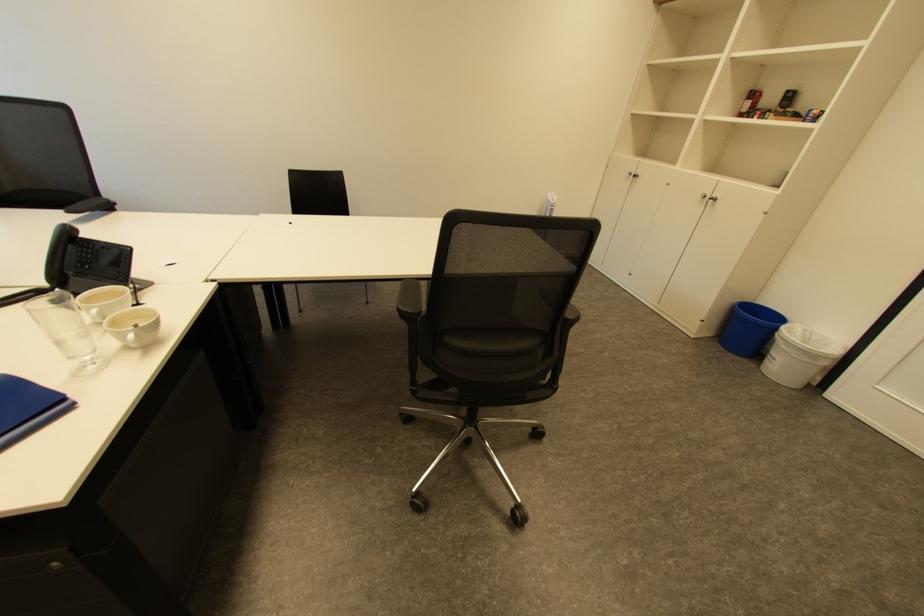
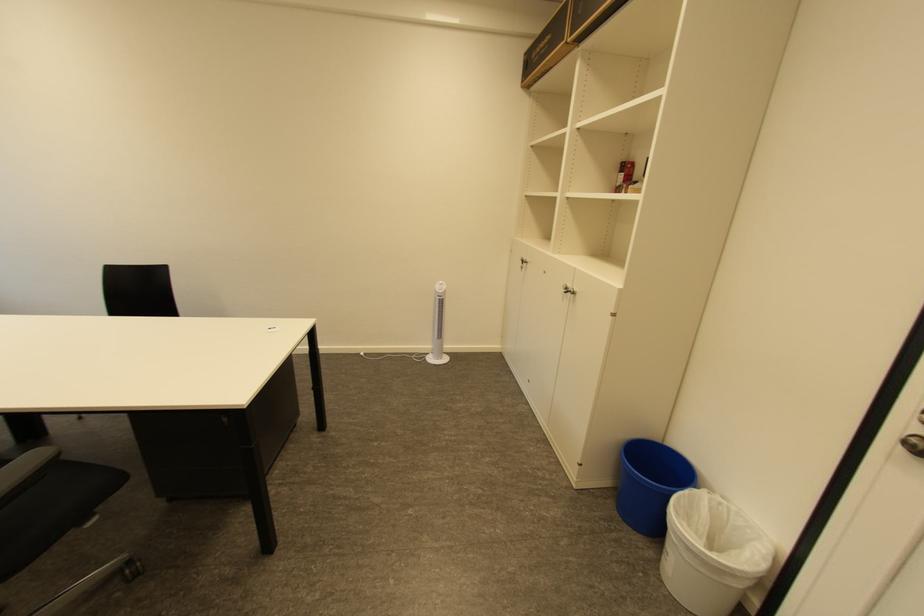
Which direction would the cameraman need to move to produce the second image?

The cameraman moved toward right, forward.